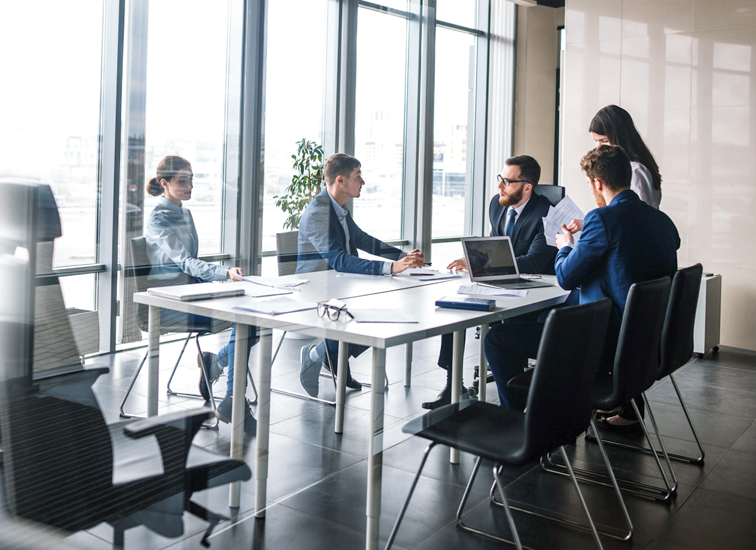
At what (x,y) coordinates should I click in order to perform the action: click on chairs. Please return your answer as a coordinate pair (x, y). Looking at the image, I should click on (546, 398), (631, 341), (676, 327), (78, 418).